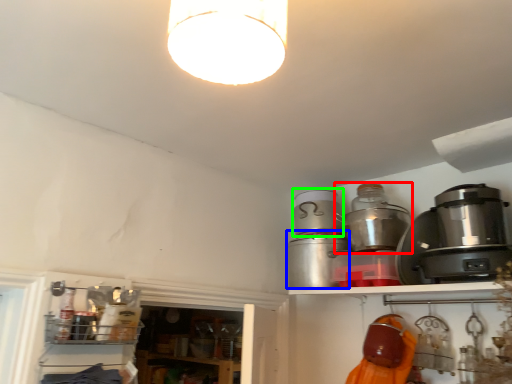
Question: Which object is the closest to the appliance (highlighted by a red box)? Choose among these: appliance (highlighted by a blue box) or appliance (highlighted by a green box).

Choices:
 (A) appliance
 (B) appliance

Answer: (B)